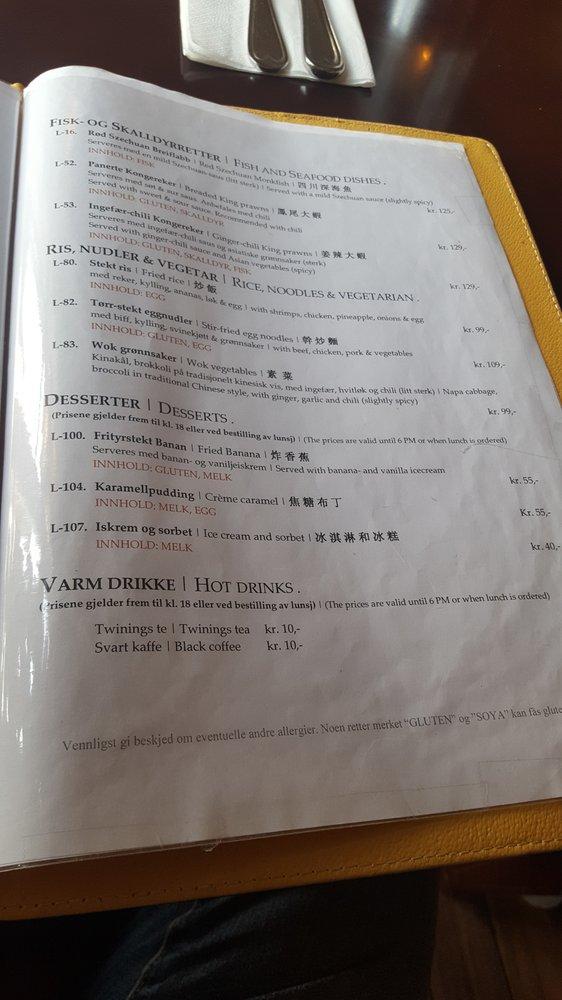
Find the location of a particular element. The height and width of the screenshot is (1000, 562). eating utensil is located at coordinates (257, 48), (317, 44).